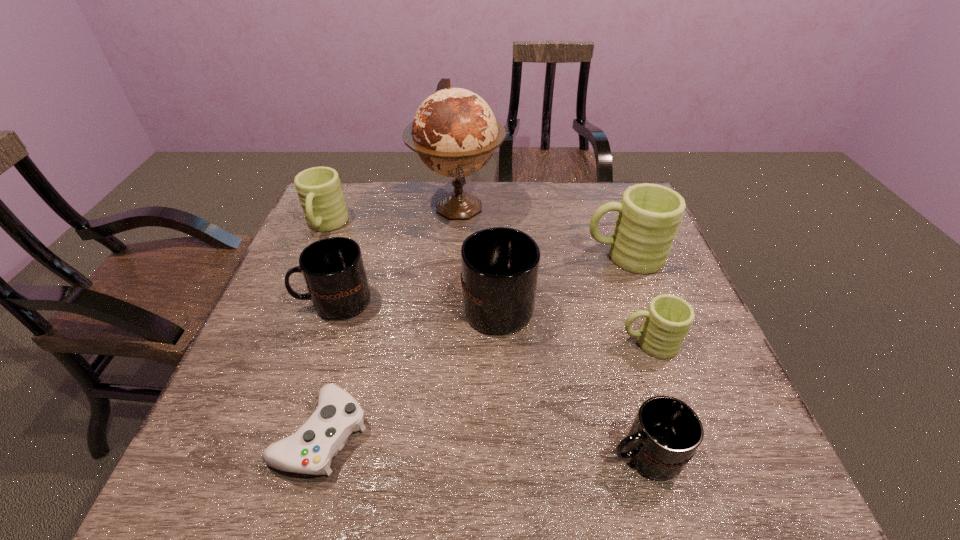
Locate an element on the screen. white control is located at coordinates (310, 450).

This screenshot has height=540, width=960. I want to click on blank space located 0.130m on the front of the globe showing Asia, so click(453, 265).

Locate an element on the screen. vacant space positioned 0.200m on the side of the biggest green mug with the handle is located at coordinates (511, 256).

Identify the location of vacant region located on the side of the biggest green mug with the handle. The width and height of the screenshot is (960, 540). [448, 256].

The image size is (960, 540). Find the location of `free space located 0.280m on the side of the biggest green mug with the handle`. free space located 0.280m on the side of the biggest green mug with the handle is located at coordinates (482, 256).

Where is `free location located with the handle on the side of the fourth mug from right to left`? This screenshot has height=540, width=960. free location located with the handle on the side of the fourth mug from right to left is located at coordinates (494, 234).

Image resolution: width=960 pixels, height=540 pixels. What are the coordinates of `free space located 0.200m with the handle on the side of the fourth mug from right to left` in the screenshot? It's located at (494, 226).

The height and width of the screenshot is (540, 960). Find the location of `vacant space situated with the handle on the side of the fourth mug from right to left`. vacant space situated with the handle on the side of the fourth mug from right to left is located at coordinates 495,254.

You are a GUI agent. You are given a task and a screenshot of the screen. Output one action in this format:
    pyautogui.click(x=<x>, y=<y>)
    Task: Click on the free spot located 0.180m on the side of the second smallest green mug with the handle
    The image size is (960, 540).
    Given the screenshot: What is the action you would take?
    pyautogui.click(x=299, y=289)

Find the location of `vacant position located 0.310m on the side of the nearest green mug with the handle`. vacant position located 0.310m on the side of the nearest green mug with the handle is located at coordinates pos(481,343).